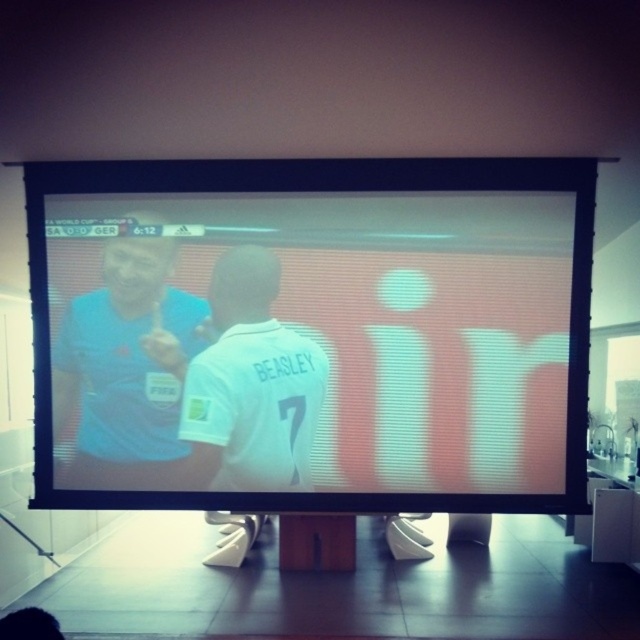
Describe the element at coordinates (131, 371) in the screenshot. The width and height of the screenshot is (640, 640). I see `matte blue shirt at upper left` at that location.

Does matte blue shirt at upper left have a larger size compared to white jersey at center?

Indeed, matte blue shirt at upper left has a larger size compared to white jersey at center.

Does point (97, 445) come behind point (250, 301)?

Yes, it is.

Identify the location of matte blue shirt at upper left. (131, 371).

Does matte black monitor at center appear over white jersey at center?

Correct, matte black monitor at center is located above white jersey at center.

Is matte black monitor at center closer to camera compared to white jersey at center?

Yes, it is.

Does point (516, 280) come farther from viewer compared to point (285, 332)?

No, (516, 280) is closer to viewer.

You are a GUI agent. You are given a task and a screenshot of the screen. Output one action in this format:
    pyautogui.click(x=<x>, y=<y>)
    Task: Click on the matte black monitor at center
    This screenshot has width=640, height=640.
    Given the screenshot: What is the action you would take?
    pyautogui.click(x=310, y=333)

Consider the image. Can you confirm if matte black monitor at center is shorter than matte blue shirt at upper left?

In fact, matte black monitor at center may be taller than matte blue shirt at upper left.

Based on the photo, is matte black monitor at center wider than matte blue shirt at upper left?

Indeed, matte black monitor at center has a greater width compared to matte blue shirt at upper left.

Is point (227, 502) positioned behind point (152, 248)?

No.

The height and width of the screenshot is (640, 640). In order to click on matte black monitor at center in this screenshot , I will do `click(310, 333)`.